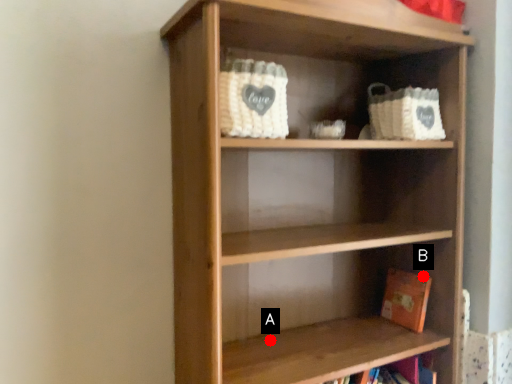
Question: Two points are circled on the image, labeled by A and B beside each circle. Which point is closer to the camera?

Choices:
 (A) A is closer
 (B) B is closer

Answer: (A)